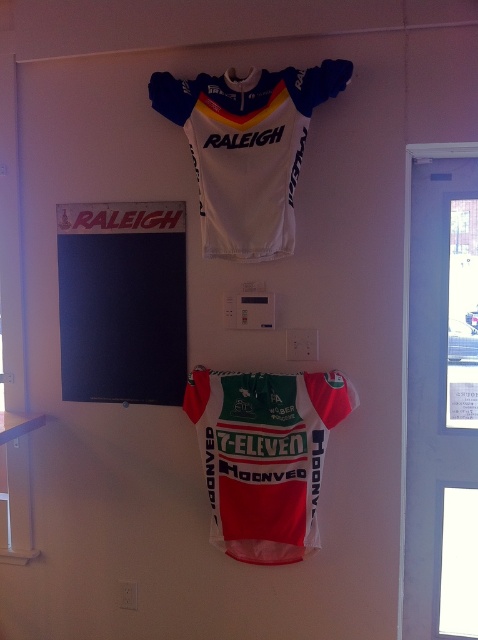
Question: Which of the following is the farthest from the observer?

Choices:
 (A) (129, 332)
 (B) (215, 212)
 (C) (223, 545)

Answer: (A)

Question: Observing the image, what is the correct spatial positioning of black matte poster at upper center in reference to white matte jersey at upper center?

Choices:
 (A) below
 (B) above

Answer: (A)

Question: Observing the image, what is the correct spatial positioning of red/white/green jersey at center in reference to white matte jersey at upper center?

Choices:
 (A) left
 (B) right

Answer: (B)

Question: Which object is farther from the camera taking this photo?

Choices:
 (A) white matte jersey at upper center
 (B) red/white/green jersey at center

Answer: (B)

Question: Which point appears closest to the camera in this image?

Choices:
 (A) (271, 467)
 (B) (152, 225)
 (C) (228, 209)

Answer: (C)

Question: Does black matte poster at upper center appear on the right side of white matte jersey at upper center?

Choices:
 (A) no
 (B) yes

Answer: (A)